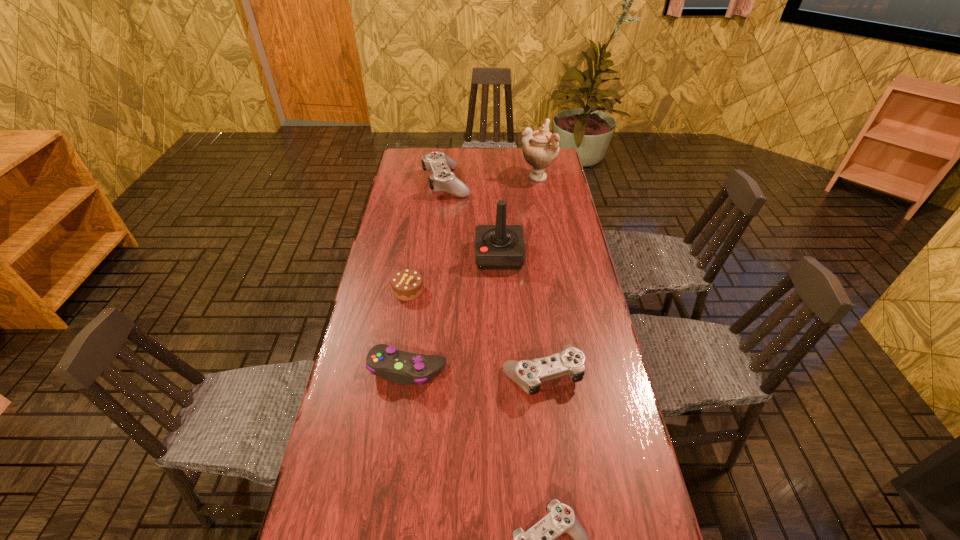
At what (x,y) coordinates should I click in order to perform the action: click on vacant area that lies between the urn and the second biggest white control. Please return your answer as a coordinate pair (x, y). Looking at the image, I should click on (540, 275).

Where is `object that is the second closest one to the second biggest white control`? This screenshot has height=540, width=960. object that is the second closest one to the second biggest white control is located at coordinates (540, 539).

Identify which object is the third nearest to the second nearest white control. Please provide its 2D coordinates. Your answer should be formatted as a tuple, i.e. [(x, y)], where the tuple contains the x and y coordinates of a point satisfying the conditions above.

[(407, 285)]

Identify which control is the second closest to the second biggest white control. Please provide its 2D coordinates. Your answer should be formatted as a tuple, i.e. [(x, y)], where the tuple contains the x and y coordinates of a point satisfying the conditions above.

[(540, 539)]

Select which control is the closest to the gray control. Please provide its 2D coordinates. Your answer should be formatted as a tuple, i.e. [(x, y)], where the tuple contains the x and y coordinates of a point satisfying the conditions above.

[(528, 374)]

Identify which white control is the second closest to the gray control. Please provide its 2D coordinates. Your answer should be formatted as a tuple, i.e. [(x, y)], where the tuple contains the x and y coordinates of a point satisfying the conditions above.

[(540, 539)]

Image resolution: width=960 pixels, height=540 pixels. I want to click on the closest white control to the farthest white control, so click(528, 374).

Locate an element on the screen. The image size is (960, 540). free space that satisfies the following two spatial constraints: 1. on the back side of the gray control; 2. on the left side of the urn is located at coordinates (435, 177).

Where is `vacant position in the image that satisfies the following two spatial constraints: 1. on the front side of the second farthest white control; 2. on the left side of the fourth farthest object`? This screenshot has width=960, height=540. vacant position in the image that satisfies the following two spatial constraints: 1. on the front side of the second farthest white control; 2. on the left side of the fourth farthest object is located at coordinates pos(395,374).